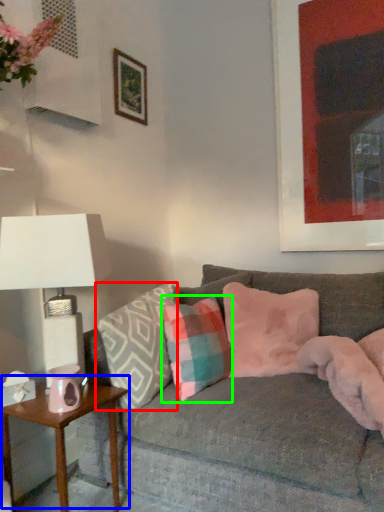
Question: Which object is the closest to the pillow (highlighted by a red box)? Choose among these: table (highlighted by a blue box) or pillow (highlighted by a green box).

Choices:
 (A) table
 (B) pillow

Answer: (B)